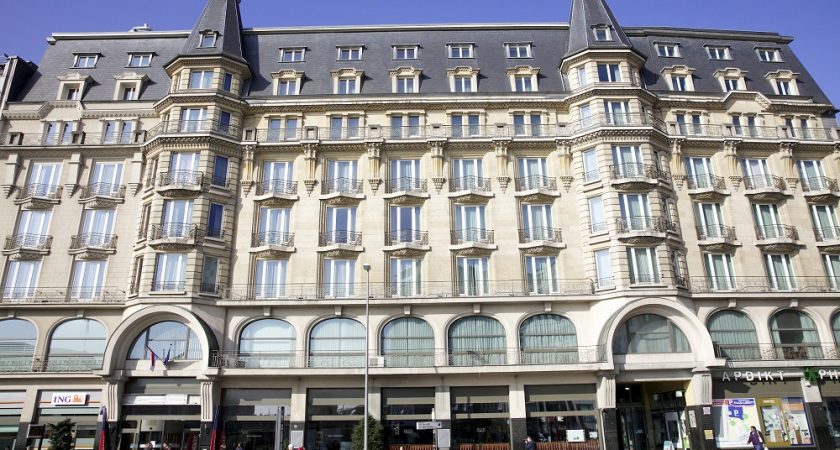
Where is `bulletin board`? bulletin board is located at coordinates (736, 425).